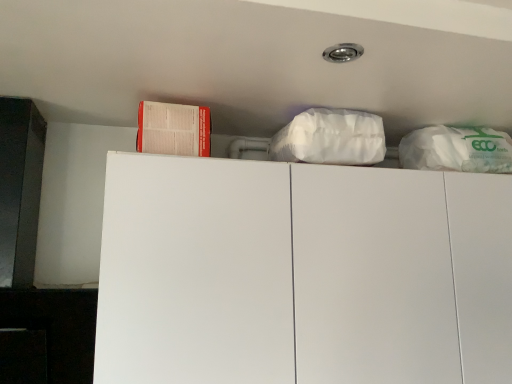
Question: Is red paper book at upper left thinner than white matte cabinet at upper center?

Choices:
 (A) yes
 (B) no

Answer: (A)

Question: Is red paper book at upper left bigger than white matte cabinet at upper center?

Choices:
 (A) yes
 (B) no

Answer: (B)

Question: Can you confirm if red paper book at upper left is wider than white matte cabinet at upper center?

Choices:
 (A) no
 (B) yes

Answer: (A)

Question: From the image's perspective, is red paper book at upper left on top of white matte cabinet at upper center?

Choices:
 (A) no
 (B) yes

Answer: (B)

Question: Is red paper book at upper left taller than white matte cabinet at upper center?

Choices:
 (A) no
 (B) yes

Answer: (A)

Question: Is white matte cabinet at upper center surrounded by red paper book at upper left?

Choices:
 (A) no
 (B) yes

Answer: (A)

Question: Can you see white matte cabinet at upper center touching red paper book at upper left?

Choices:
 (A) yes
 (B) no

Answer: (B)

Question: Is white matte cabinet at upper center shorter than red paper book at upper left?

Choices:
 (A) no
 (B) yes

Answer: (A)

Question: From a real-world perspective, is white matte cabinet at upper center positioned over red paper book at upper left based on gravity?

Choices:
 (A) yes
 (B) no

Answer: (B)

Question: Considering the relative positions of white matte cabinet at upper center and red paper book at upper left in the image provided, is white matte cabinet at upper center to the right of red paper book at upper left from the viewer's perspective?

Choices:
 (A) yes
 (B) no

Answer: (A)

Question: Does white matte cabinet at upper center have a greater width compared to red paper book at upper left?

Choices:
 (A) no
 (B) yes

Answer: (B)

Question: Does white matte cabinet at upper center appear on the left side of red paper book at upper left?

Choices:
 (A) yes
 (B) no

Answer: (B)

Question: From a real-world perspective, is red paper book at upper left positioned above or below white matte cabinet at upper center?

Choices:
 (A) below
 (B) above

Answer: (B)